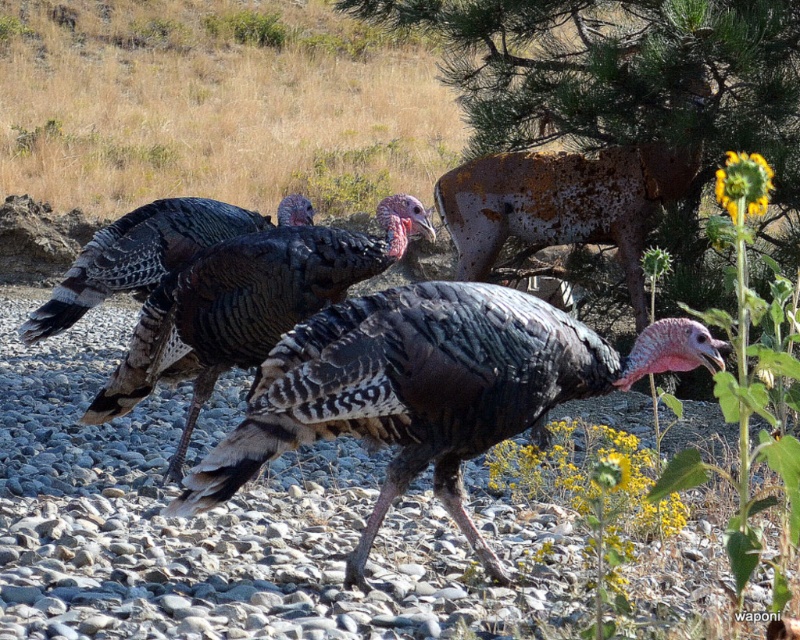
Measure the distance between shiny black turkey at center and camera.

A distance of 4.30 meters exists between shiny black turkey at center and camera.

Is point (432, 412) closer to camera compared to point (130, 404)?

Yes, it is.

Locate an element on the screen. Image resolution: width=800 pixels, height=640 pixels. shiny black turkey at center is located at coordinates (429, 388).